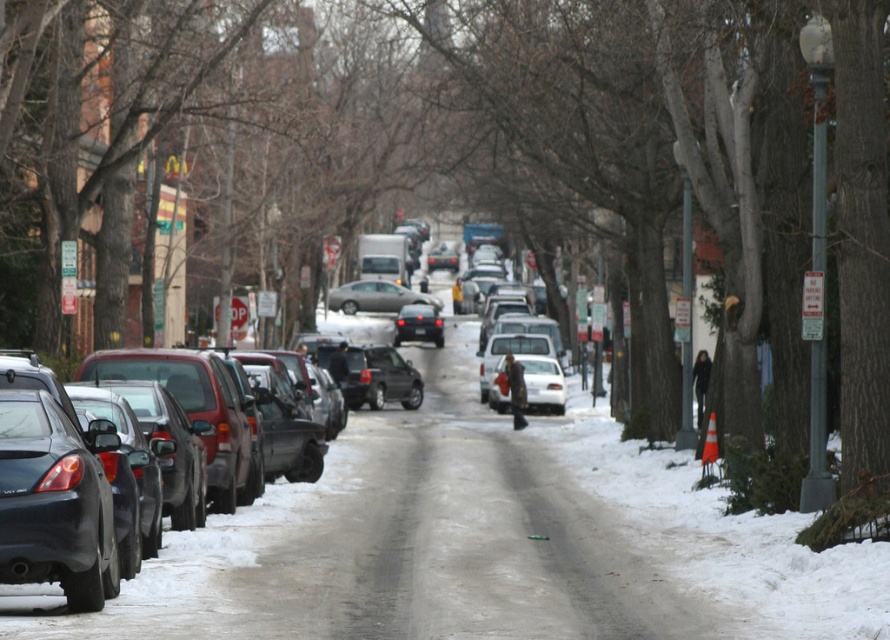
You are a delivery driver who needs to park your vehicle in this snowy street. The parking spot is located at point (328, 518). What type of vehicle is currently occupying that spot?

The parking spot at point (328, 518) is occupied by a matte black sedan at left.

From the picture: You are a delivery driver who needs to park your vehicle in this snowy street. You see a matte black sedan at left and a satin silver sedan at center. Which car has more space around it for your delivery van?

The matte black sedan at left is larger in size than the satin silver sedan at center, so there is more space around the satin silver sedan at center for your delivery van to park.

You are standing on the snowy street and want to walk towards the two points marked in the image. Which point, point (349, 438) or point (358, 280), will you reach first?

You will reach point (349, 438) first because it is closer to you than point (358, 280).